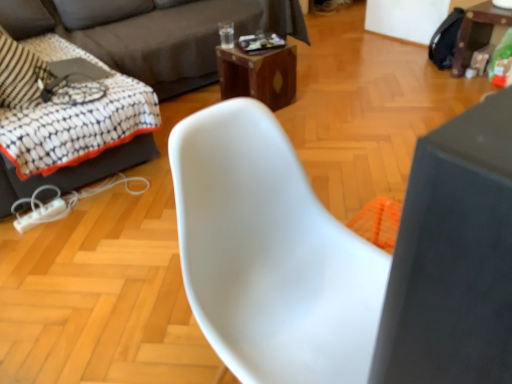
Find the location of a particular element. empty space that is ontop of woodenmaterial/texturetable at center, which is counted as the 2th table, starting from the right (from a real-world perspective) is located at coordinates (257, 51).